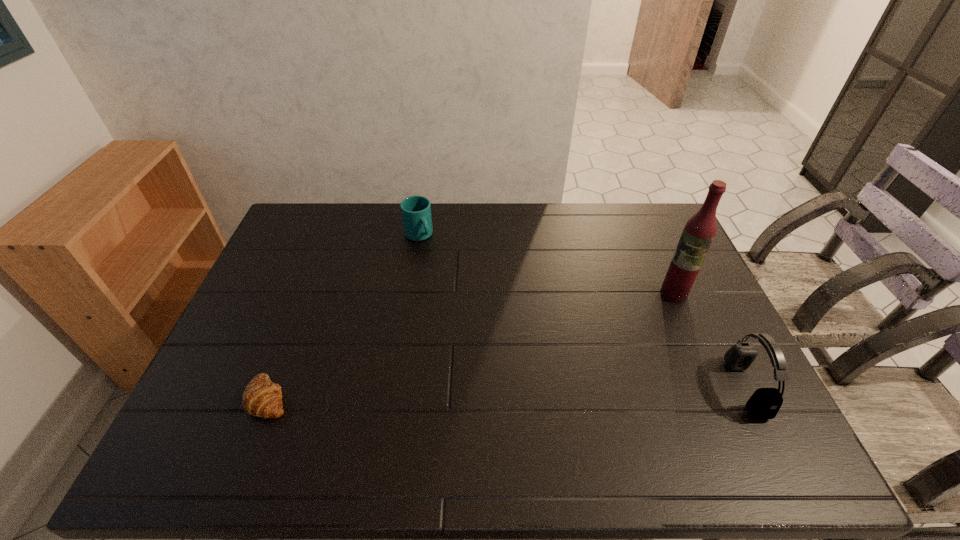
Image resolution: width=960 pixels, height=540 pixels. What are the coordinates of `vacant space on the desktop that is between the crescent roll and the third shortest object and is positioned on the handle side of the farthest object` in the screenshot? It's located at (541, 392).

The image size is (960, 540). I want to click on free space on the desktop that is between the crescent roll and the headset and is positioned on the label of the third object from left to right, so click(564, 392).